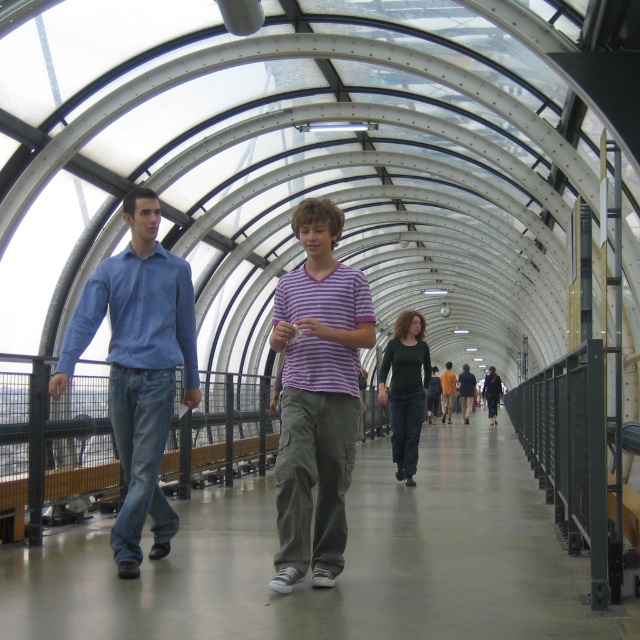
You are standing at the entrance of the walkway and want to find the purple striped shirt at center. According to the coordinates provided, in which direction should you look to locate it?

The purple striped shirt at center is located at point 0.619 along the x and 0.495 along the y. Since the coordinates are relative to the image, you should look towards the center of the walkway to find it.

You are a photographer trying to capture both the blue cotton shirt at left and the dark green sweater at center in a single frame. Given their sizes in the image, which subject should you focus on to ensure both are clearly visible without cropping?

Since the blue cotton shirt at left occupies less space than the dark green sweater at center, you should focus on the dark green sweater at center as it is larger and will remain visible even if the blue cotton shirt at left is slightly smaller in the frame.

You are a photographer standing at the entrance of the walkway and want to capture both the blue cotton shirt at left and the dark green sweater at center in a single frame. Considering their heights, which one might appear larger in the photo?

The blue cotton shirt at left is much taller than the dark green sweater at center, so it will appear larger in the photo.